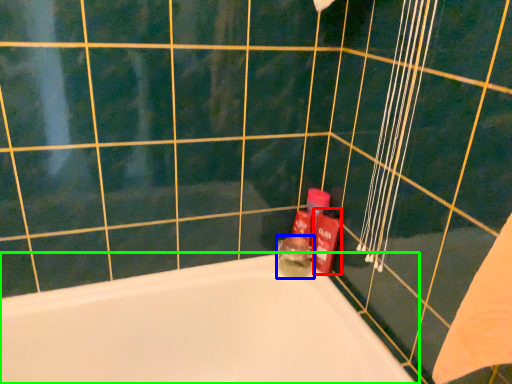
Question: Estimate the real-world distances between objects in this image. Which object is closer to toiletry (highlighted by a red box), toiletry (highlighted by a blue box) or bathtub (highlighted by a green box)?

Choices:
 (A) toiletry
 (B) bathtub

Answer: (A)